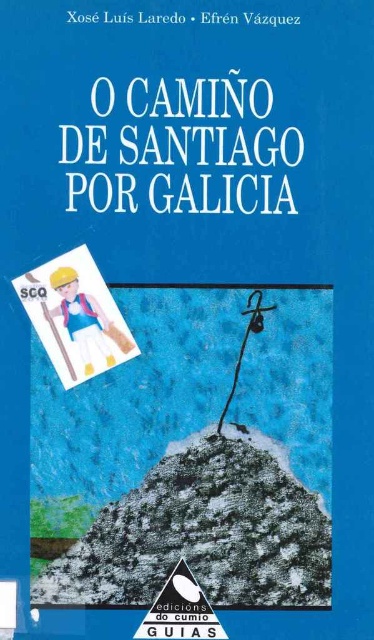
Question: Which of the following is the farthest from the observer?

Choices:
 (A) matte plastic figure at center
 (B) plastic toy figure at upper left

Answer: (B)

Question: Is matte plastic figure at center behind white paper sign at upper left?

Choices:
 (A) yes
 (B) no

Answer: (B)

Question: Is matte plastic figure at center thinner than plastic toy figure at upper left?

Choices:
 (A) yes
 (B) no

Answer: (B)

Question: Which object appears farthest from the camera in this image?

Choices:
 (A) white paper sign at upper left
 (B) plastic toy figure at upper left
 (C) matte plastic figure at center

Answer: (B)

Question: Which of these objects is positioned farthest from the plastic toy figure at upper left?

Choices:
 (A) white paper sign at upper left
 (B) matte plastic figure at center

Answer: (B)

Question: Is matte plastic figure at center bigger than plastic toy figure at upper left?

Choices:
 (A) yes
 (B) no

Answer: (A)